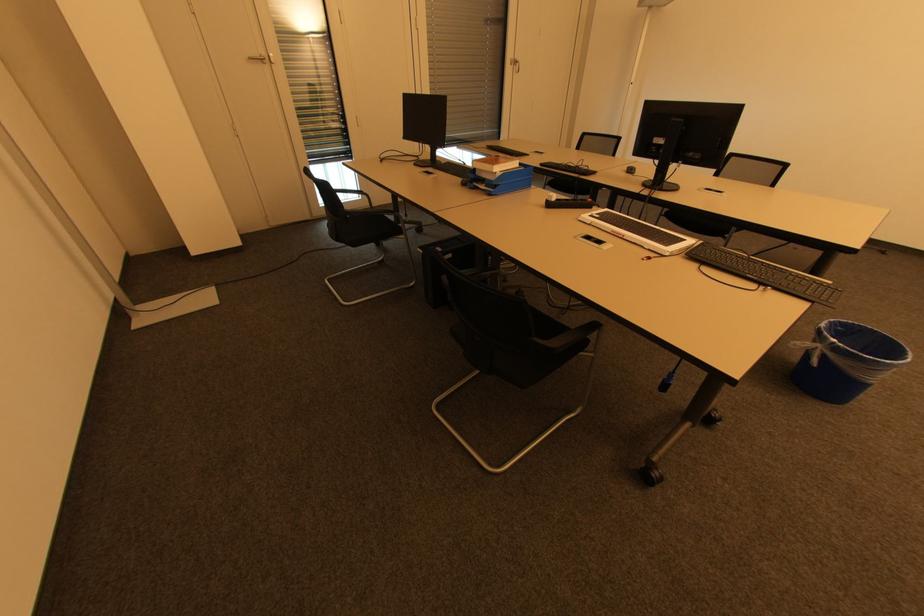
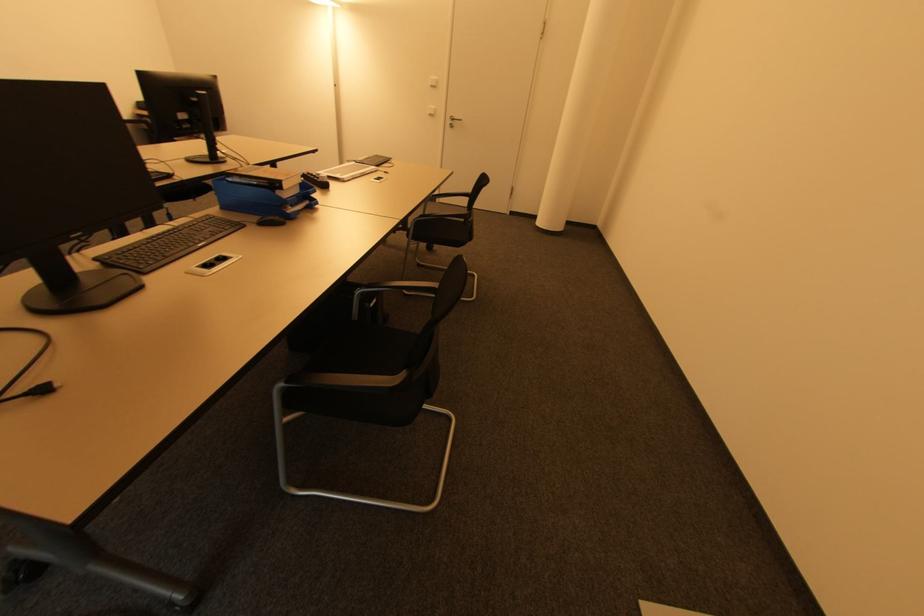
In the second image, find the point that corresponds to (x=488, y=187) in the first image.

(294, 207)